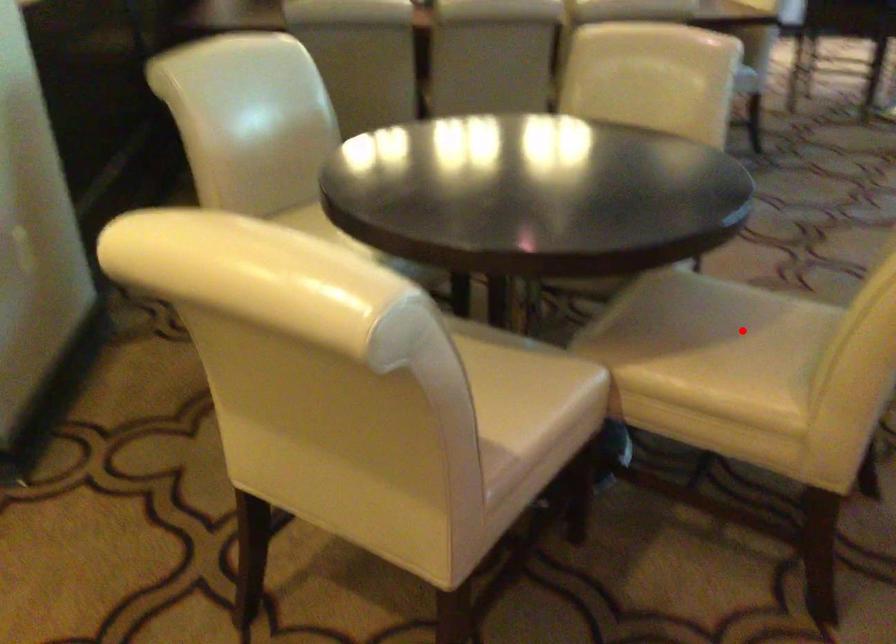
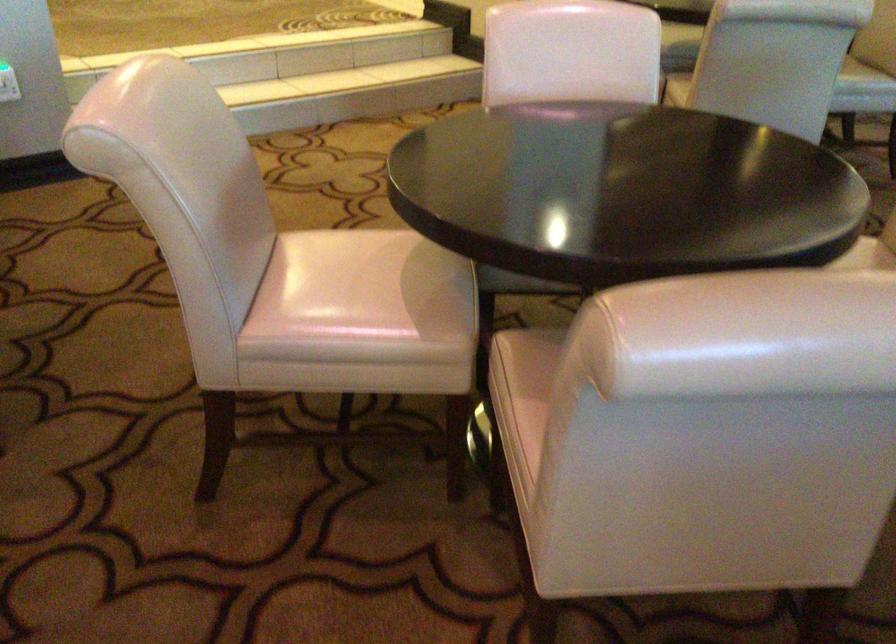
Question: I am providing you with two images of the same scene from different viewpoints. A red point is marked on the first image. Is the red point's position out of view in image 2?

Choices:
 (A) Yes
 (B) No

Answer: (A)